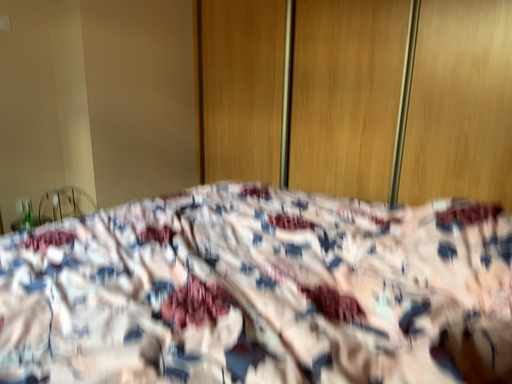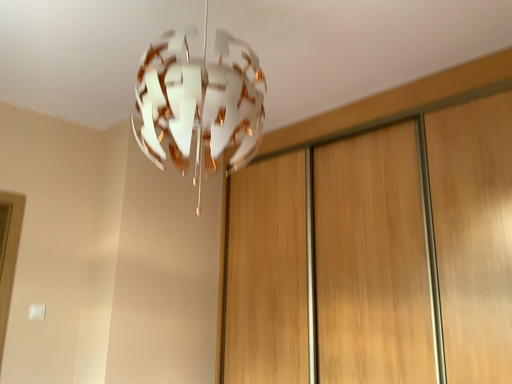
Question: Which way did the camera rotate in the video?

Choices:
 (A) rotated upward
 (B) rotated downward

Answer: (A)